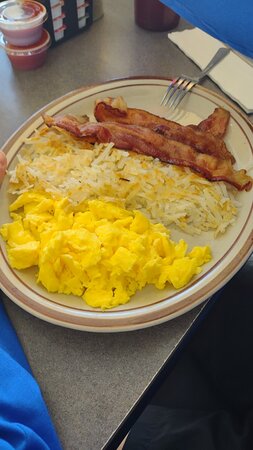
Identify the location of white plate. This screenshot has width=253, height=450. (221, 244).